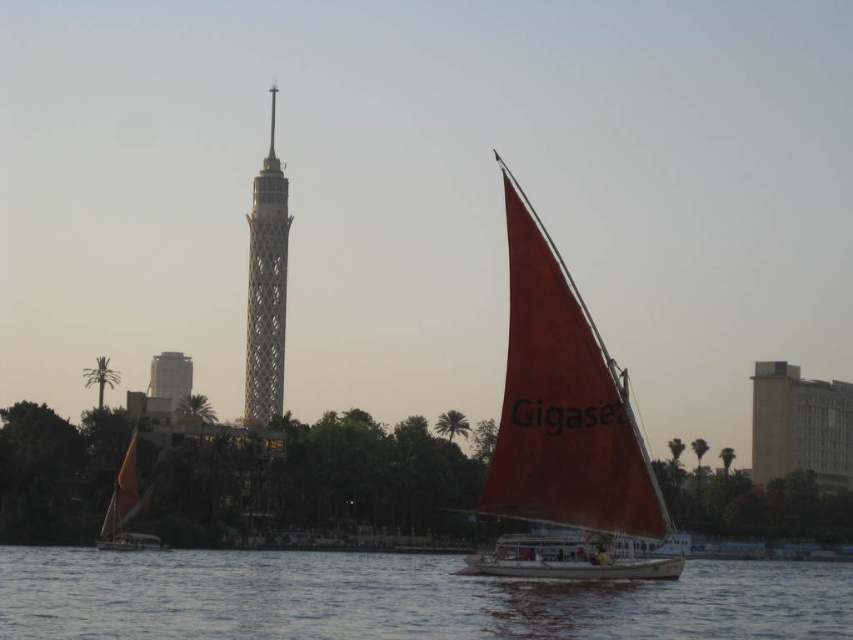
Question: Among these points, which one is farthest from the camera?

Choices:
 (A) (277, 276)
 (B) (711, 612)
 (C) (618, 371)

Answer: (A)

Question: Is matte red sail at right below metallic lattice tower at center?

Choices:
 (A) no
 (B) yes

Answer: (B)

Question: Is blue water at lower center thinner than matte red sail at right?

Choices:
 (A) no
 (B) yes

Answer: (A)

Question: Which object is closer to the camera taking this photo?

Choices:
 (A) metallic lattice tower at center
 (B) blue water at lower center

Answer: (B)

Question: Can you confirm if blue water at lower center is wider than matte red sail at right?

Choices:
 (A) no
 (B) yes

Answer: (B)

Question: Which point is closer to the camera?

Choices:
 (A) (264, 298)
 (B) (577, 541)
 (C) (20, 634)

Answer: (B)